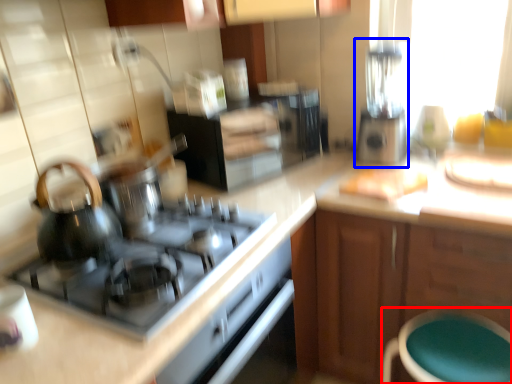
Question: Among these objects, which one is nearest to the camera, bar stool (highlighted by a red box) or blender (highlighted by a blue box)?

Choices:
 (A) bar stool
 (B) blender

Answer: (A)